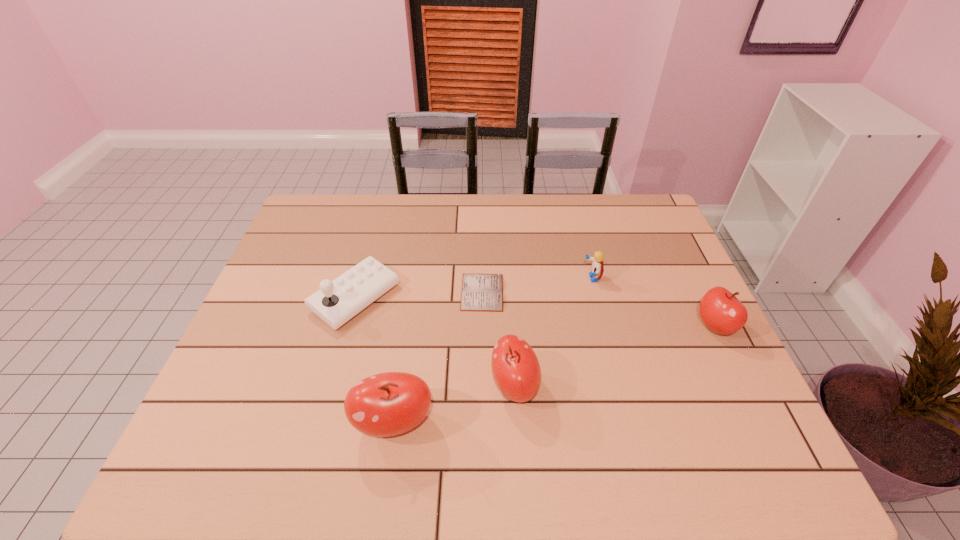
The height and width of the screenshot is (540, 960). What are the coordinates of `vacant space situated 0.130m on the right of the second shortest apple` in the screenshot? It's located at (593, 386).

Identify the location of free space located 0.240m on the back of the farthest apple. (678, 251).

The height and width of the screenshot is (540, 960). I want to click on free space located 0.080m on the right of the joystick, so click(x=427, y=298).

Where is `vacant area situated on the back of the shortest object`? vacant area situated on the back of the shortest object is located at coordinates (482, 207).

You are a GUI agent. You are given a task and a screenshot of the screen. Output one action in this format:
    pyautogui.click(x=<x>, y=<y>)
    Task: Click on the free point located on the front-facing side of the second object from right to left
    The height and width of the screenshot is (540, 960).
    Given the screenshot: What is the action you would take?
    (498, 278)

Identify the location of free space located 0.100m on the front-facing side of the second object from right to left. (549, 278).

You are a GUI agent. You are given a task and a screenshot of the screen. Output one action in this format:
    pyautogui.click(x=<x>, y=<y>)
    Task: Click on the vacant space located on the front-facing side of the second object from right to left
    Image resolution: width=960 pixels, height=540 pixels.
    Given the screenshot: What is the action you would take?
    pyautogui.click(x=522, y=278)

Identify the location of object that is positioned at the left edge. The height and width of the screenshot is (540, 960). (337, 301).

This screenshot has width=960, height=540. I want to click on object that is at the right edge, so click(x=721, y=311).

The height and width of the screenshot is (540, 960). Identify the location of vacant space at the far edge of the desktop. (501, 197).